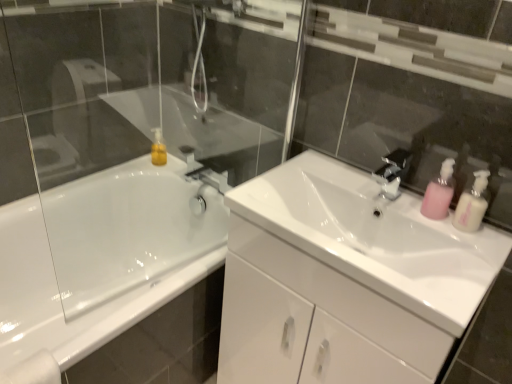
The width and height of the screenshot is (512, 384). I want to click on free location to the left of black metallic faucet at upper center, so click(332, 181).